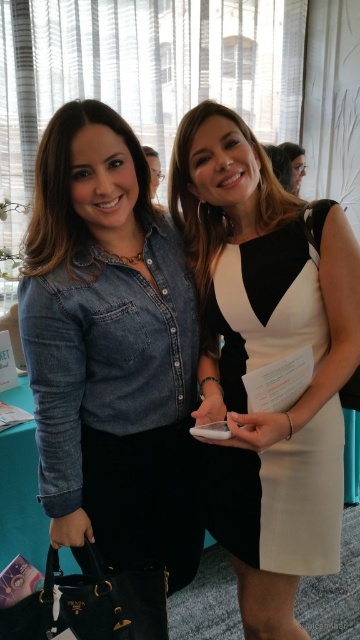
Is denim shirt at left in front of white matte dress at center?

Yes, denim shirt at left is in front of white matte dress at center.

Is denim shirt at left shorter than white matte dress at center?

No, denim shirt at left is not shorter than white matte dress at center.

Is point (111, 285) more distant than point (282, 268)?

No, (111, 285) is in front of (282, 268).

This screenshot has height=640, width=360. What are the coordinates of `denim shirt at left` in the screenshot? It's located at (110, 349).